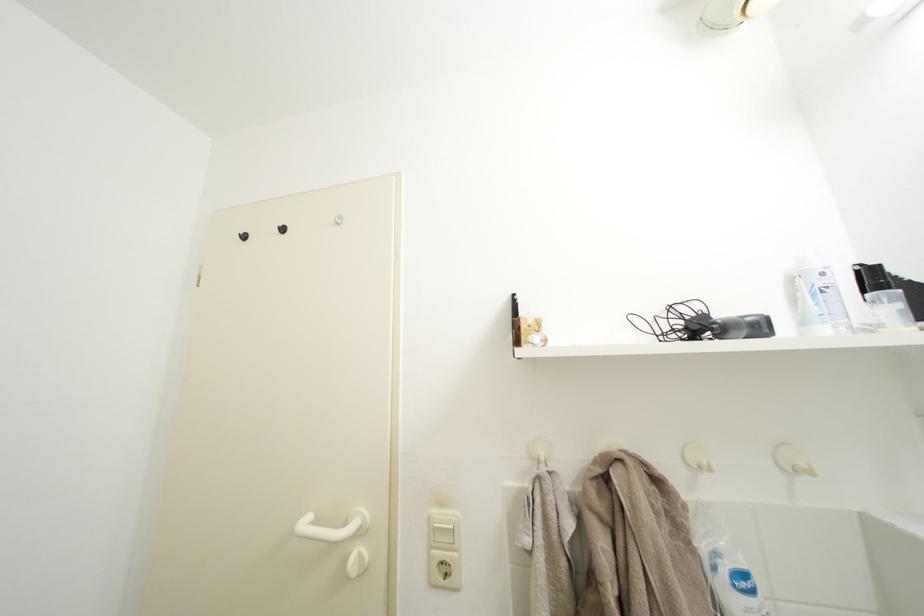
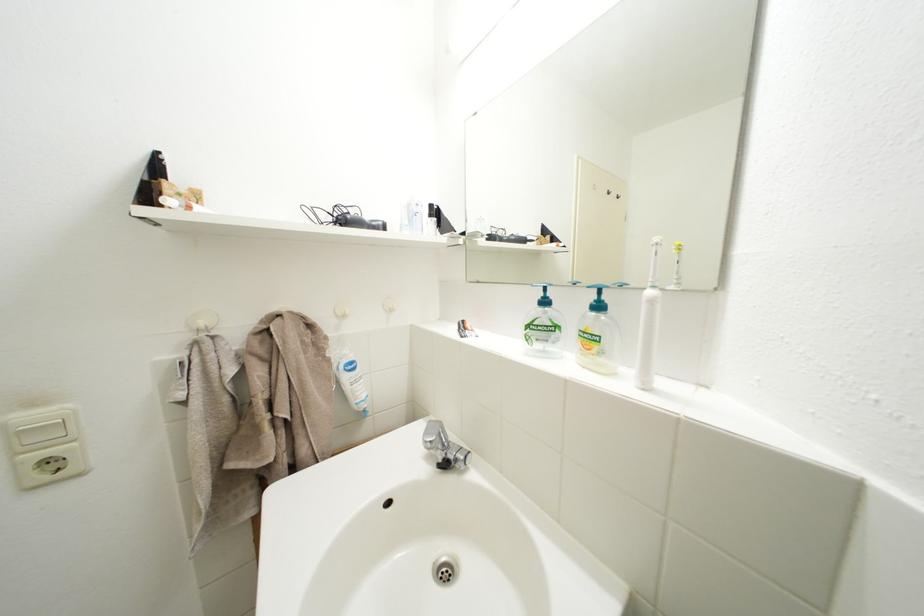
Locate, in the second image, the point that corresponds to the point at 438,525 in the first image.

(14, 432)